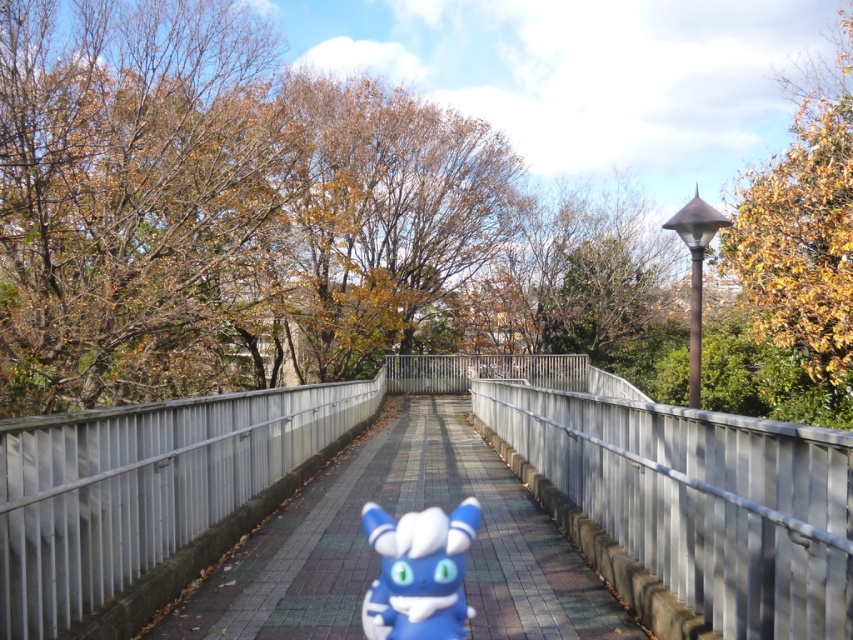
Where is `metallic silver rail at center`? The image size is (853, 640). metallic silver rail at center is located at coordinates (700, 500).

Which is in front, point (740, 492) or point (241, 394)?

Positioned in front is point (740, 492).

Find the location of a particular element. This screenshot has height=640, width=853. metallic silver rail at center is located at coordinates tap(700, 500).

Where is `metallic gray rail at center`? This screenshot has width=853, height=640. metallic gray rail at center is located at coordinates (143, 486).

Is metallic gray rail at center closer to the viewer compared to smooth concrete walkway at center?

That is True.

Image resolution: width=853 pixels, height=640 pixels. I want to click on metallic gray rail at center, so click(x=143, y=486).

Is metallic gray rail at center bigger than blue rubber toy at center?

Correct, metallic gray rail at center is larger in size than blue rubber toy at center.

Does metallic gray rail at center appear on the left side of blue rubber toy at center?

Indeed, metallic gray rail at center is positioned on the left side of blue rubber toy at center.

This screenshot has height=640, width=853. Identify the location of metallic gray rail at center. (143, 486).

Locate an element on the screen. The width and height of the screenshot is (853, 640). metallic gray rail at center is located at coordinates (143, 486).